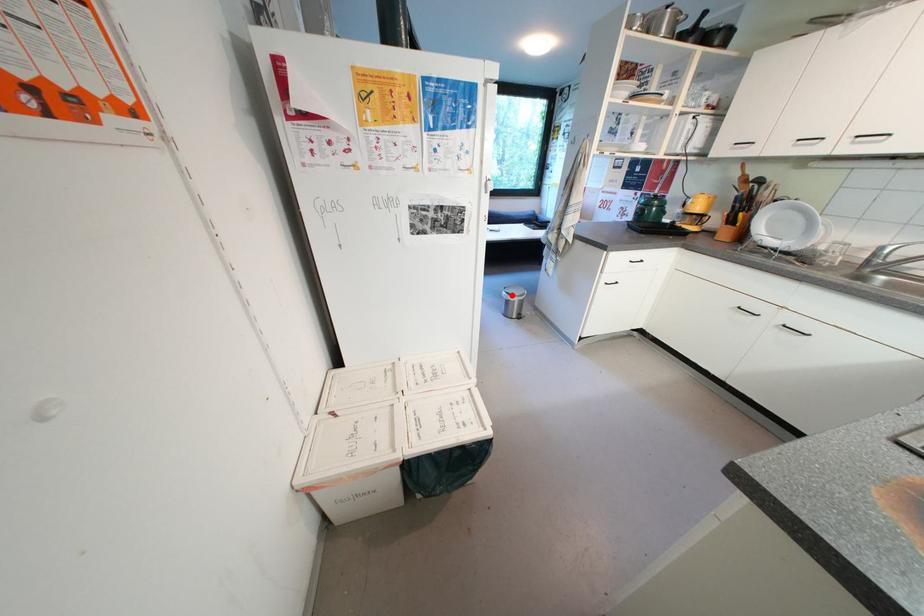
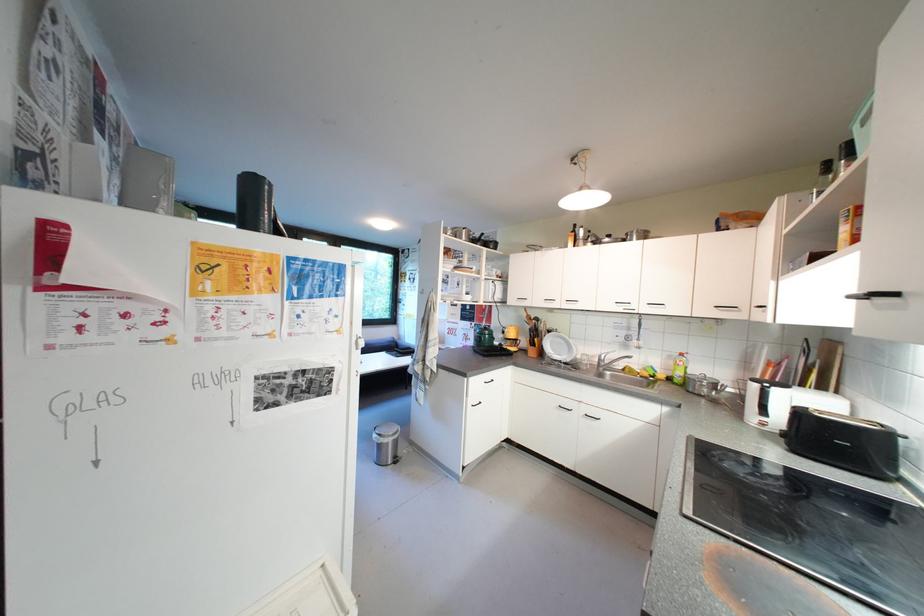
Question: I am providing you with two images of the same scene from different viewpoints. A red point is marked on the first image. Is the red point's position out of view in image 2?

Choices:
 (A) Yes
 (B) No

Answer: (B)